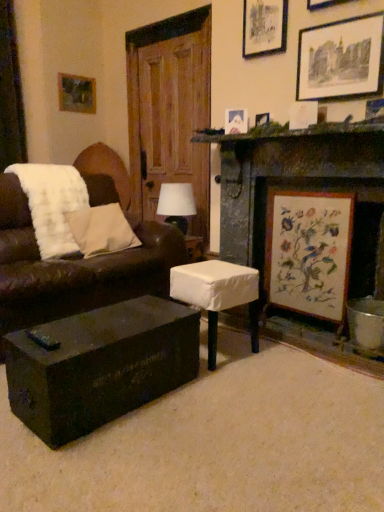
Question: From a real-world perspective, is white fabric-covered stool at center physically located above or below white fluffy pillow at left?

Choices:
 (A) below
 (B) above

Answer: (A)

Question: Is white fabric-covered stool at center spatially inside white fluffy pillow at left, or outside of it?

Choices:
 (A) outside
 (B) inside

Answer: (A)

Question: Based on their relative distances, which object is farther from the brown leather couch at left?

Choices:
 (A) matte black picture frame at upper center, arranged as the fourth picture frame when viewed from the right
 (B) matte white picture frame at upper center, placed as the fifth picture frame when sorted from right to left
 (C) wooden fireplace at right
 (D) green mossy stone mantle at upper right
 (E) wooden picture frame at upper left, the 1th picture frame in the back-to-front sequence

Answer: (E)

Question: Which object is the farthest from the wooden picture frame at upper left, the 1th picture frame in the back-to-front sequence?

Choices:
 (A) matte white picture frame at upper right, which is counted as the 5th picture frame, starting from the top
 (B) wooden fireplace at right
 (C) brown leather couch at left
 (D) green mossy stone mantle at upper right
 (E) white fluffy pillow at left

Answer: (B)